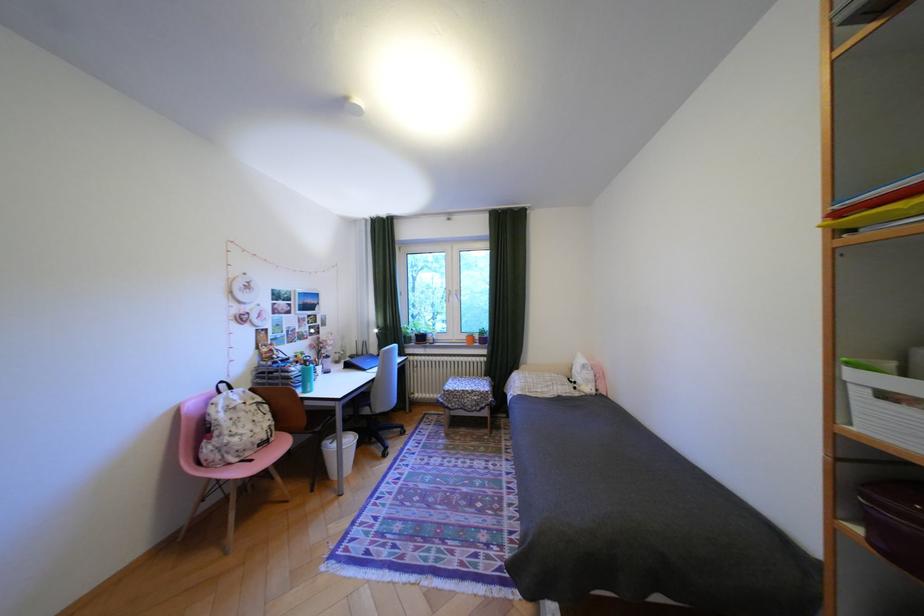
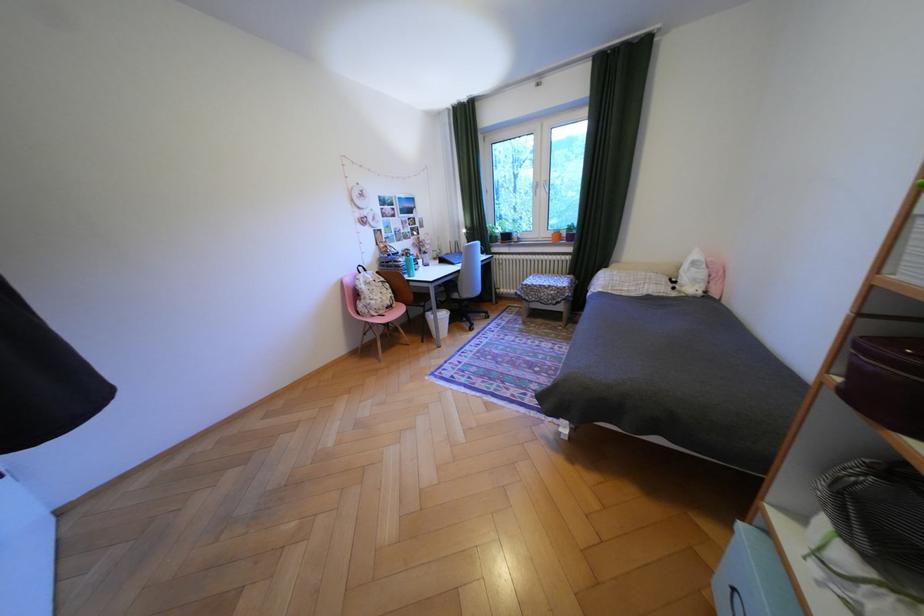
Locate, in the second image, the point that corresponds to (x=342, y=447) in the first image.

(442, 315)